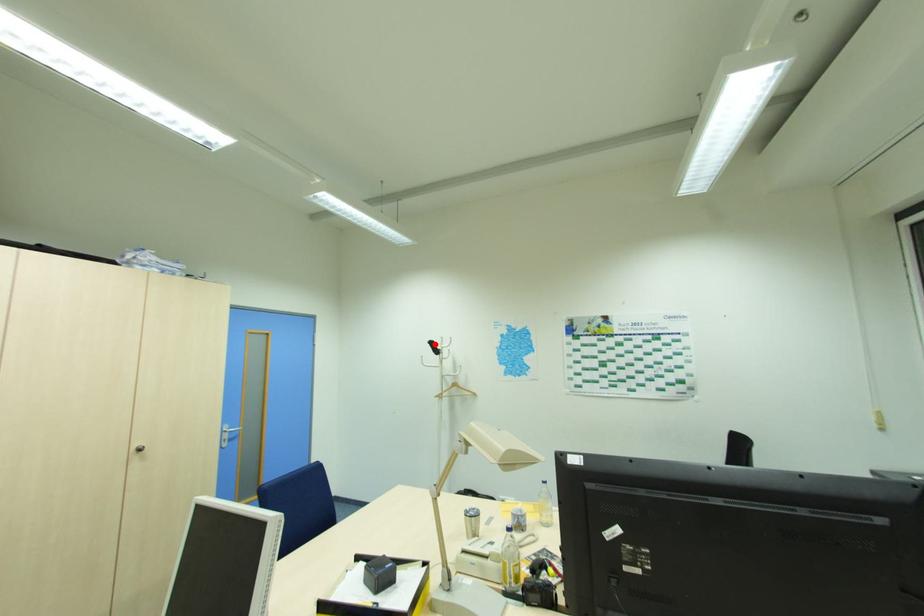
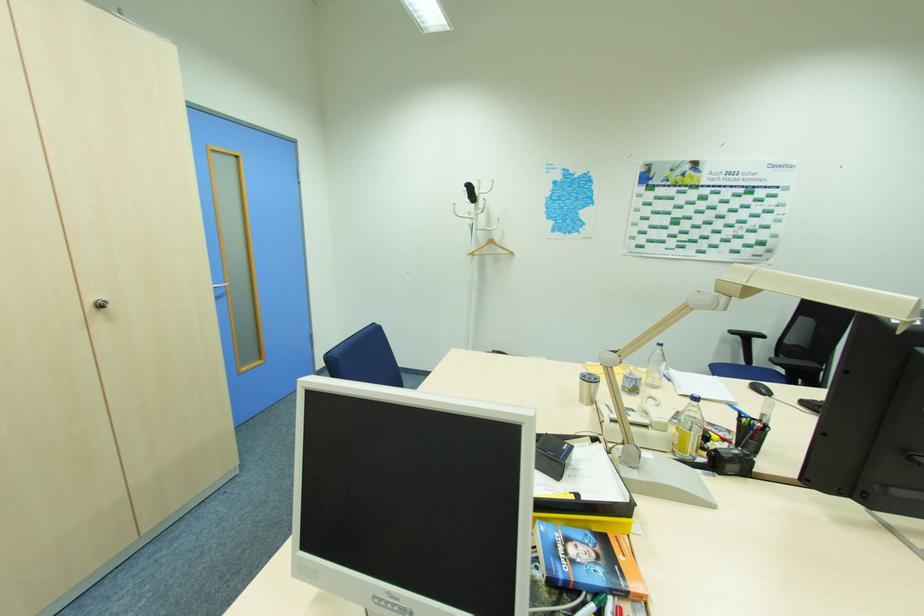
Question: I am providing you with two images of the same scene from different viewpoints. In image1, a red point is highlighted. Considering the same 3D point in image2, which of the following is correct?

Choices:
 (A) It is closer
 (B) It is farther

Answer: (A)